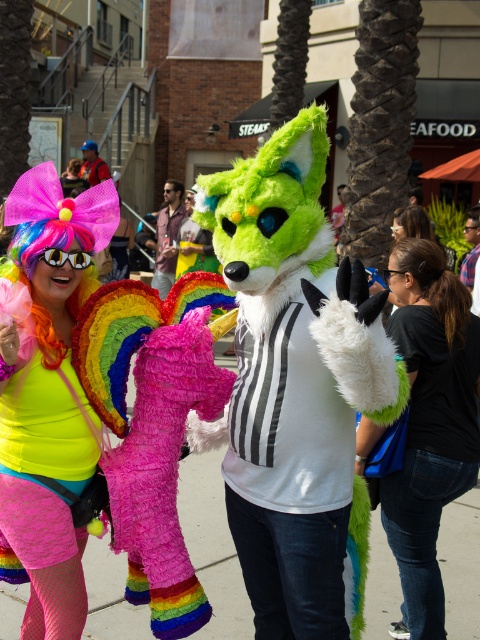
You are standing in the festival crowd and want to take a photo of the neon matte wig at upper left. If your camera has a maximum focus range of 8 feet, will you be able to capture it clearly?

The neon matte wig at upper left is 8.53 feet away from you, which exceeds the camera maximum focus range of 8 feet. So you won need to move closer to capture it clearly.

You are standing at the edge of the scene and want to walk towards the pavement at center. Is the black hair at center blocking your path?

The pavement at center has a larger size compared to black hair at center, so the black hair at center is not blocking the path to the pavement at center.